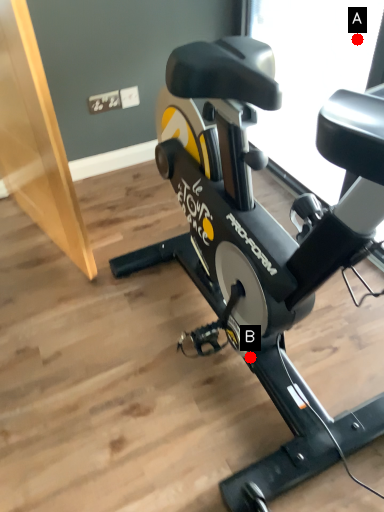
Question: Two points are circled on the image, labeled by A and B beside each circle. Which point appears closest to the camera in this image?

Choices:
 (A) A is closer
 (B) B is closer

Answer: (B)